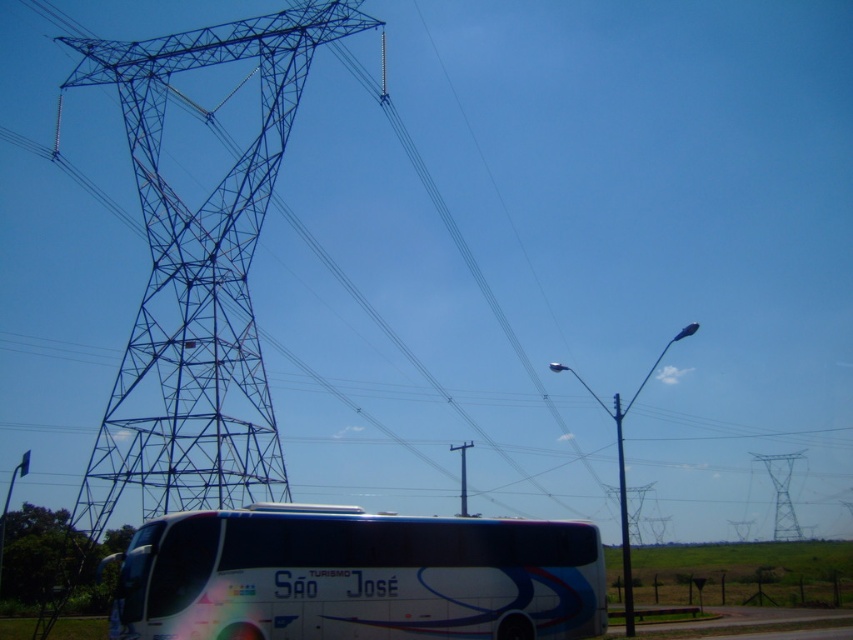
Is the position of metallic blue tower at left less distant than that of metallic gray pole at right?

Yes.

Who is higher up, metallic blue tower at left or metallic gray pole at right?

metallic blue tower at left is higher up.

Who is more forward, (x=341, y=12) or (x=624, y=596)?

Point (x=341, y=12) is in front.

You are a GUI agent. You are given a task and a screenshot of the screen. Output one action in this format:
    pyautogui.click(x=<x>, y=<y>)
    Task: Click on the metallic blue tower at left
    This screenshot has width=853, height=640.
    Given the screenshot: What is the action you would take?
    pyautogui.click(x=194, y=285)

Does metallic blue tower at right appear on the right side of metallic gray pole at right?

Yes, metallic blue tower at right is to the right of metallic gray pole at right.

Looking at this image, can you confirm if metallic blue tower at right is thinner than metallic gray pole at right?

Incorrect, metallic blue tower at right's width is not less than metallic gray pole at right's.

Where is `metallic blue tower at right`? The width and height of the screenshot is (853, 640). metallic blue tower at right is located at coordinates (781, 493).

Measure the distance between point (555, 556) and camera.

Point (555, 556) is 173.53 meters away from camera.

Measure the distance from white glossy bus at lower center to metallic blue tower at right.

white glossy bus at lower center is 264.16 feet from metallic blue tower at right.

Which is in front, point (461, 634) or point (778, 499)?

Point (461, 634) is in front.

Find the location of a particular element. The height and width of the screenshot is (640, 853). white glossy bus at lower center is located at coordinates (357, 577).